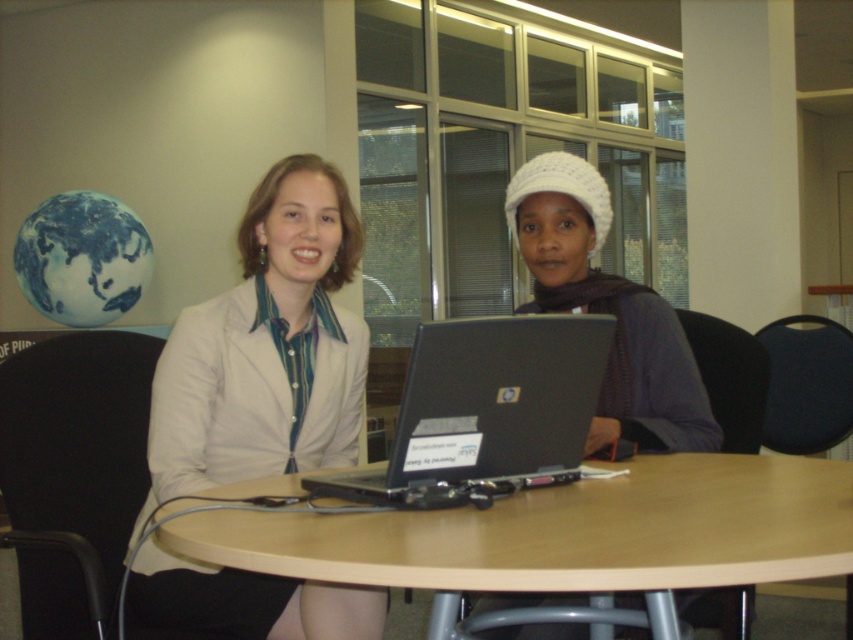
Question: Is matte white blazer at center wider than black matte laptop at center?

Choices:
 (A) yes
 (B) no

Answer: (B)

Question: Which is farther from the wooden at center?

Choices:
 (A) matte white blazer at center
 (B) black matte laptop at center

Answer: (A)

Question: Among these objects, which one is farthest from the camera?

Choices:
 (A) black matte laptop at center
 (B) wooden at center

Answer: (A)

Question: Considering the real-world distances, which object is closest to the wooden at center?

Choices:
 (A) black matte laptop at center
 (B) matte white blazer at center

Answer: (A)

Question: Can you confirm if matte white blazer at center is positioned below black matte laptop at center?

Choices:
 (A) no
 (B) yes

Answer: (A)

Question: Can you confirm if wooden at center is smaller than matte white blazer at center?

Choices:
 (A) yes
 (B) no

Answer: (A)